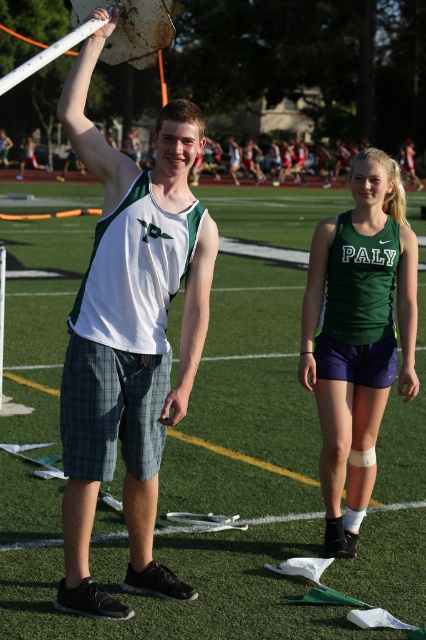
You are a photographer standing at the edge of the field. You need to capture a photo of the matte white tank top at center without the green fabric field at center blocking it. Is this possible based on their positions?

The green fabric field at center is positioned over the matte white tank top at center, so it would block the view. To capture the matte white tank top at center without obstruction, you would need to adjust your angle or move to a position where the green fabric field at center is not in front.

You are a photographer at the track and field event. You need to capture a closeup shot of both the matte white tank top at center and the green matte tank top at center. Since your camera can only focus on one subject at a time, which tank top should you choose to ensure the entire subject fits in the frame without cropping?

The matte white tank top at center has a larger width than the green matte tank top at center, so to ensure the entire subject fits in the frame without cropping, you should focus on the matte white tank top at center first since it is wider. After capturing that, you can then take a shot of the green matte tank top at center as it is narrower and would require less framing space.

What is the 2D coordinate of the green fabric field at center?

The 2D coordinate of the green fabric field at center is at point (x=201, y=492).